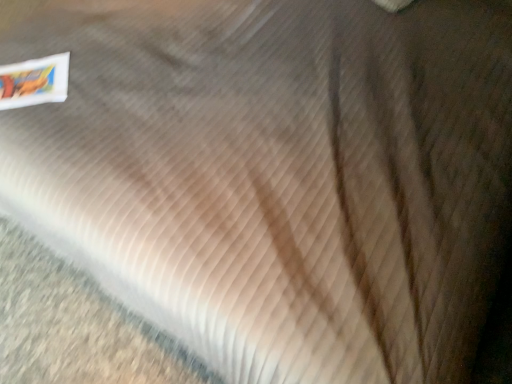
This screenshot has width=512, height=384. Describe the element at coordinates (34, 81) in the screenshot. I see `white glossy postcard at upper left` at that location.

Locate an element on the screen. The image size is (512, 384). white glossy postcard at upper left is located at coordinates (34, 81).

What is the approximate width of white glossy postcard at upper left?

It is 12.44 inches.

Find the location of a particular element. The width and height of the screenshot is (512, 384). white glossy postcard at upper left is located at coordinates (34, 81).